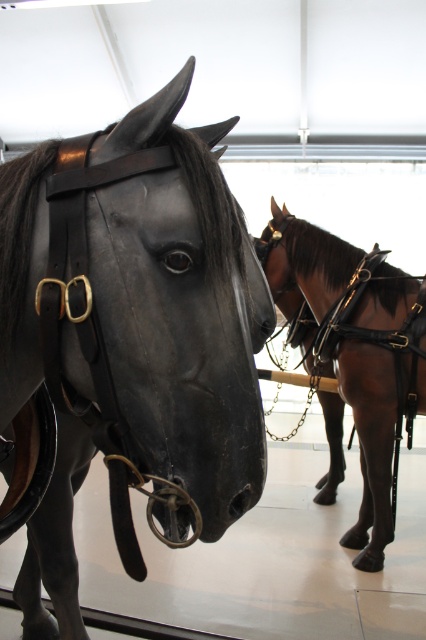
You are standing in the museum and want to take a photo of both horse statues. You notice two points marked on the floor at coordinates point (109, 294) and point (411, 412). Which point should you stand at to ensure both statues are fully visible in your camera frame?

You should stand at point (109, 294) because it is in front of point (411, 412), providing a better vantage point to see both horse statues fully.

You are a visitor at the museum and want to take a photo of both the black polished wood horse at center and the brown glossy horse at center. If you stand in the middle of the room, which direction should you face to ensure both horses are in your view?

You should face to the right because the black polished wood horse at center is to the left of the brown glossy horse at center, so facing right will keep both in view.

You are a museum visitor holding a 12 inch ruler. You want to measure the distance between your eyes and the black polished wood horse at center. Can you estimate if the ruler will be long enough to reach the horse?

The black polished wood horse at center is 29.75 inches from camera. Since the ruler is only 12 inches long, it is not long enough to reach the horse.